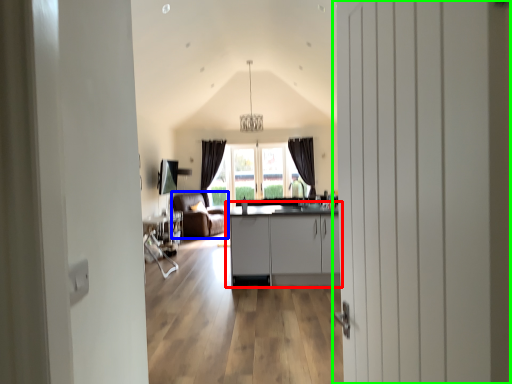
Question: Considering the real-world distances, which object is closest to cabinetry (highlighted by a red box)? armchair (highlighted by a blue box) or door (highlighted by a green box).

Choices:
 (A) armchair
 (B) door

Answer: (A)